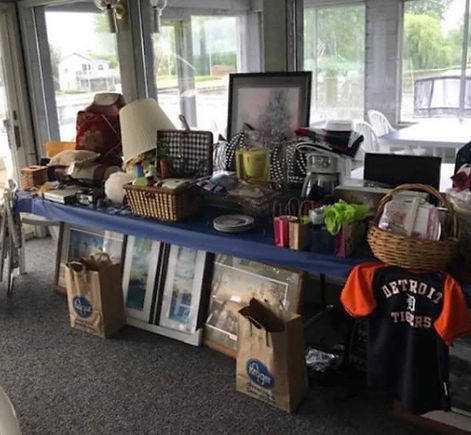
The width and height of the screenshot is (471, 435). Find the location of `lamp shade`. lamp shade is located at coordinates (142, 126).